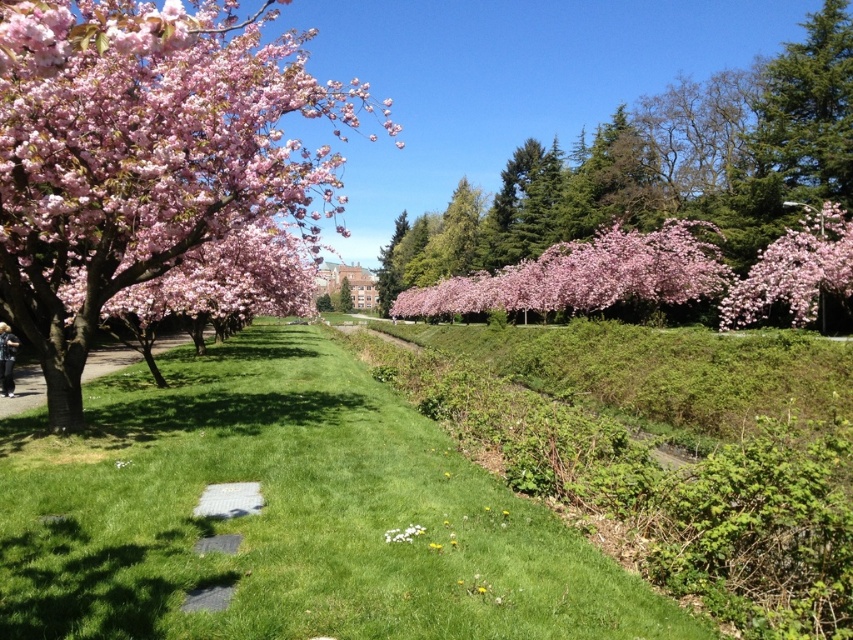
Who is taller, pink matte flower at center or green leafy tree at center?

Standing taller between the two is green leafy tree at center.

Which is more to the left, pink matte flower at center or green leafy tree at center?

From the viewer's perspective, green leafy tree at center appears more on the left side.

You are a GUI agent. You are given a task and a screenshot of the screen. Output one action in this format:
    pyautogui.click(x=<x>, y=<y>)
    Task: Click on the pink matte flower at center
    
    Given the screenshot: What is the action you would take?
    (x=585, y=275)

Can you confirm if pink blossoms at center is smaller than pink matte flower at upper right?

No, pink blossoms at center is not smaller than pink matte flower at upper right.

Can you confirm if pink blossoms at center is bigger than pink matte flower at upper right?

Yes.

What do you see at coordinates (662, 168) in the screenshot? I see `pink blossoms at center` at bounding box center [662, 168].

Where is `pink blossoms at center`? The image size is (853, 640). pink blossoms at center is located at coordinates (662, 168).

Which is above, green grass at center or pink blossoms at center?

pink blossoms at center is higher up.

Who is taller, green grass at center or pink blossoms at center?

With more height is pink blossoms at center.

Does point (53, 451) come closer to viewer compared to point (596, 216)?

Yes, it is in front of point (596, 216).

In order to click on green grass at center in this screenshot , I will do `click(287, 515)`.